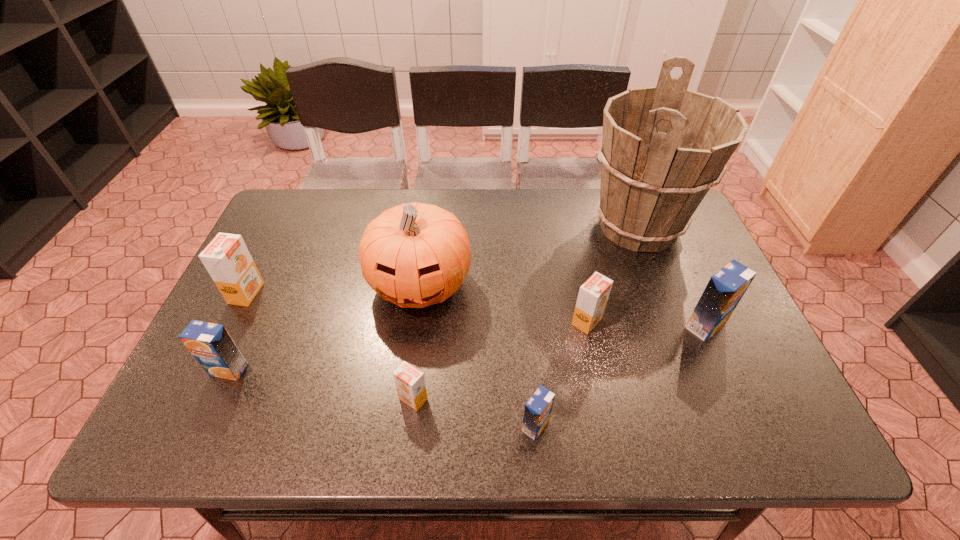
Where is `free space located 0.120m on the front of the second biggest blue orange_juice`? The width and height of the screenshot is (960, 540). free space located 0.120m on the front of the second biggest blue orange_juice is located at coordinates (200, 433).

Locate an element on the screen. The image size is (960, 540). free region located on the right of the nearest orange orange juice is located at coordinates (581, 399).

At what (x,y) coordinates should I click in order to perform the action: click on vacant space situated 0.120m on the right of the smallest blue orange_juice. Please return your answer as a coordinate pair (x, y). Image resolution: width=960 pixels, height=540 pixels. Looking at the image, I should click on (609, 426).

Locate an element on the screen. This screenshot has width=960, height=540. object situated at the far edge is located at coordinates (663, 147).

The image size is (960, 540). In order to click on bucket located in the right edge section of the desktop in this screenshot , I will do `click(663, 147)`.

Locate an element on the screen. This screenshot has width=960, height=540. orange_juice that is positioned at the right edge is located at coordinates (726, 287).

Identify the location of object located in the far right corner section of the desktop. This screenshot has height=540, width=960. (663, 147).

This screenshot has width=960, height=540. What are the coordinates of `free spot at the far edge of the desktop` in the screenshot? It's located at (341, 188).

I want to click on vacant area at the left edge, so click(x=266, y=249).

Image resolution: width=960 pixels, height=540 pixels. I want to click on free spot at the right edge of the desktop, so [739, 315].